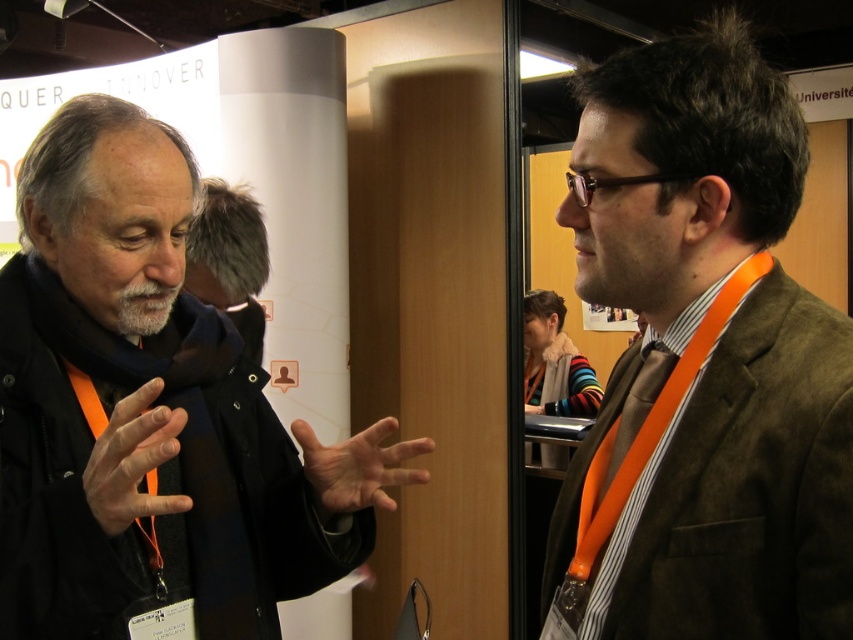
Question: Which of the following is the closest to the observer?

Choices:
 (A) fuzzy gray hat at upper left
 (B) brown woolen suit at right
 (C) matte black jacket at left

Answer: (B)

Question: Which object is positioned closest to the fuzzy gray hat at upper left?

Choices:
 (A) brown woolen suit at right
 (B) matte black jacket at left

Answer: (B)

Question: Is brown woolen suit at right in front of matte black jacket at left?

Choices:
 (A) yes
 (B) no

Answer: (A)

Question: Is brown woolen suit at right positioned at the back of fuzzy gray hat at upper left?

Choices:
 (A) yes
 (B) no

Answer: (B)

Question: Is brown woolen suit at right positioned behind matte black jacket at left?

Choices:
 (A) yes
 (B) no

Answer: (B)

Question: Which of the following is the closest to the observer?

Choices:
 (A) brown woolen suit at right
 (B) fuzzy gray hat at upper left
 (C) matte black jacket at left

Answer: (A)